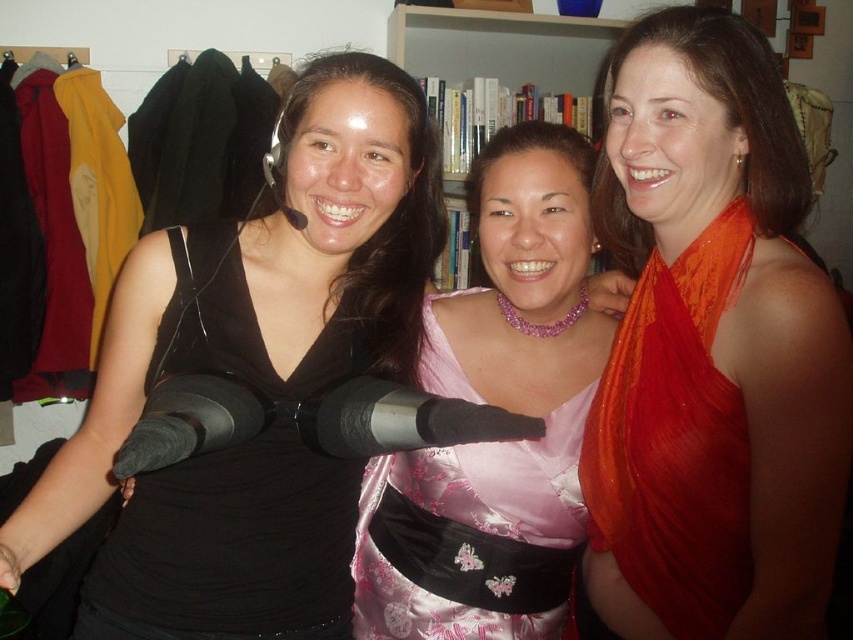
Question: Is pink satin dress at center wider than hardcover books at center?

Choices:
 (A) no
 (B) yes

Answer: (A)

Question: Which object appears farthest from the camera in this image?

Choices:
 (A) pink satin dress at center
 (B) hardcover books at center
 (C) black satin dress at left
 (D) orange silk scarf at upper right

Answer: (B)

Question: Is orange silk scarf at upper right thinner than black satin dress at left?

Choices:
 (A) yes
 (B) no

Answer: (A)

Question: Is orange silk scarf at upper right thinner than hardcover books at center?

Choices:
 (A) yes
 (B) no

Answer: (A)

Question: Which point appears closest to the camera in this image?

Choices:
 (A) (722, 500)
 (B) (426, 628)

Answer: (A)

Question: Which of the following is the closest to the observer?

Choices:
 (A) (265, 557)
 (B) (381, 540)
 (C) (822, 316)
 (D) (498, 51)

Answer: (C)